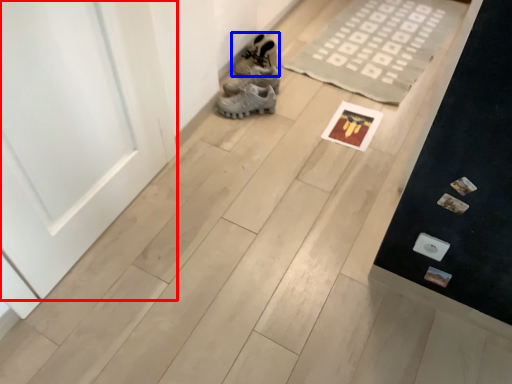
Question: Which object is closer to the camera taking this photo, door (highlighted by a red box) or footwear (highlighted by a blue box)?

Choices:
 (A) door
 (B) footwear

Answer: (A)